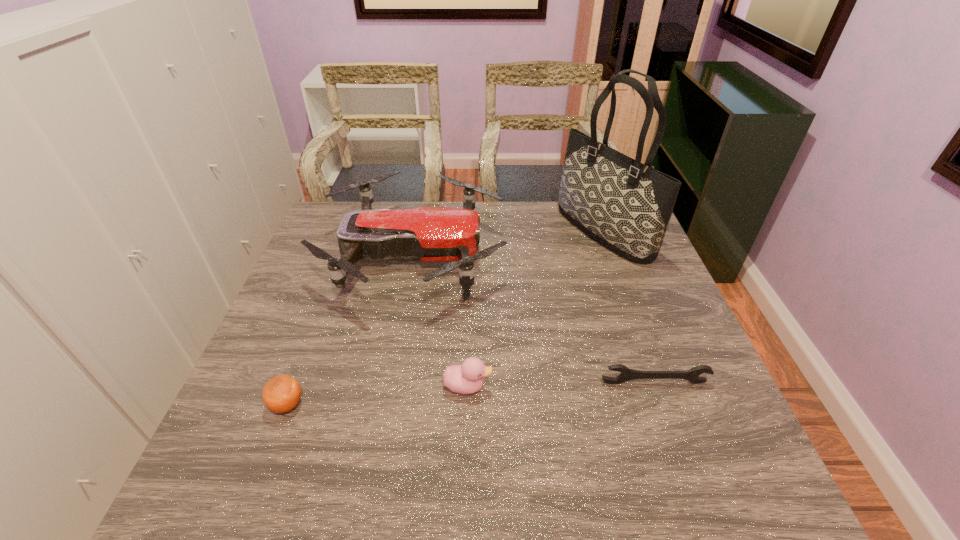
Locate an element on the screen. free spot at the left edge of the desktop is located at coordinates (317, 386).

Locate an element on the screen. free region at the right edge is located at coordinates (610, 279).

The width and height of the screenshot is (960, 540). I want to click on vacant space at the near left corner, so coord(236,490).

I want to click on free space between the tallest object and the orange, so click(445, 318).

Image resolution: width=960 pixels, height=540 pixels. Find the location of `vacant area between the tote bag and the fourth shortest object`. vacant area between the tote bag and the fourth shortest object is located at coordinates (509, 244).

This screenshot has width=960, height=540. I want to click on vacant area that lies between the orange and the tote bag, so click(x=445, y=318).

The width and height of the screenshot is (960, 540). I want to click on empty space that is in between the duckling and the wrench, so click(561, 384).

Where is `vacant area that lies between the fourth shortest object and the shortest object`? The width and height of the screenshot is (960, 540). vacant area that lies between the fourth shortest object and the shortest object is located at coordinates (534, 320).

The height and width of the screenshot is (540, 960). What are the coordinates of `free area in between the wrench and the drone` in the screenshot? It's located at [534, 320].

The width and height of the screenshot is (960, 540). In order to click on vacant space that's between the duckling and the drone in this screenshot , I will do `click(441, 321)`.